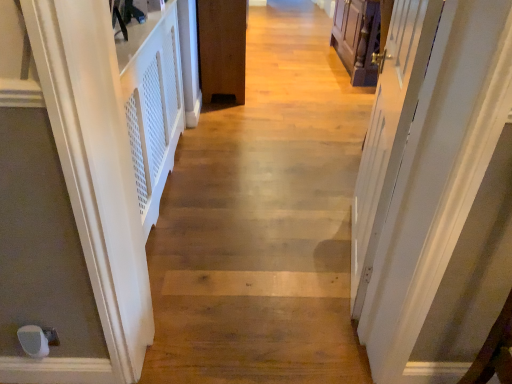
Question: Should I look upward or downward to see white matte door at left, the 2th door positioned from the right?

Choices:
 (A) down
 (B) up

Answer: (B)

Question: Which direction should I rotate to look at brown matte door at center, the 2th door when ordered from left to right?

Choices:
 (A) left
 (B) right

Answer: (A)

Question: From the image's perspective, would you say white matte door at left, the 2th door positioned from the right, is shown under brown matte door at center, the first door positioned from the back?

Choices:
 (A) yes
 (B) no

Answer: (A)

Question: Can you confirm if white matte door at left, placed as the first door when sorted from front to back, is shorter than brown matte door at center, the 2th door when ordered from left to right?

Choices:
 (A) no
 (B) yes

Answer: (A)

Question: Does white matte door at left, the 2th door positioned from the right, come behind brown matte door at center, which appears as the second door when viewed from the front?

Choices:
 (A) yes
 (B) no

Answer: (B)

Question: Is white matte door at left, the 2th door positioned from the right, to the right of brown matte door at center, the first door when ordered from right to left, from the viewer's perspective?

Choices:
 (A) yes
 (B) no

Answer: (B)

Question: From a real-world perspective, is white matte door at left, the 1th door viewed from the left, on top of brown matte door at center, which appears as the second door when viewed from the front?

Choices:
 (A) yes
 (B) no

Answer: (A)

Question: Does white matte door at left, the 1th door viewed from the left, have a larger size compared to brown matte door at center, the 2th door when ordered from left to right?

Choices:
 (A) no
 (B) yes

Answer: (A)

Question: Could white glossy door at right be considered to be inside white matte door at left, the 1th door viewed from the left?

Choices:
 (A) yes
 (B) no

Answer: (B)

Question: Does white matte door at left, marked as the second door in a back-to-front arrangement, have a lesser width compared to white glossy door at right?

Choices:
 (A) yes
 (B) no

Answer: (B)

Question: Is white matte door at left, the 1th door viewed from the left, looking in the opposite direction of white glossy door at right?

Choices:
 (A) yes
 (B) no

Answer: (B)

Question: Could you tell me if white matte door at left, the 1th door viewed from the left, is turned towards white glossy door at right?

Choices:
 (A) no
 (B) yes

Answer: (B)

Question: Is white matte door at left, placed as the first door when sorted from front to back, touching white glossy door at right?

Choices:
 (A) no
 (B) yes

Answer: (A)

Question: Does white matte door at left, marked as the second door in a back-to-front arrangement, appear on the left side of white glossy door at right?

Choices:
 (A) yes
 (B) no

Answer: (A)

Question: Is brown matte door at center, the first door positioned from the back, facing towards white matte door at left, marked as the second door in a back-to-front arrangement?

Choices:
 (A) yes
 (B) no

Answer: (B)